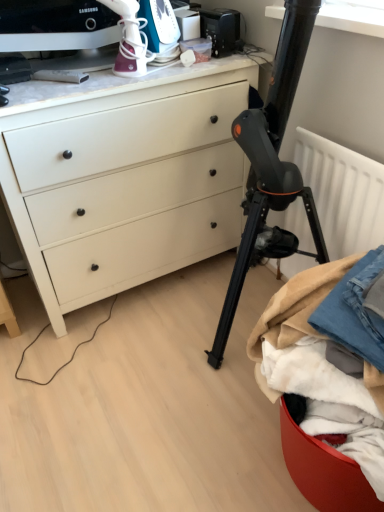
Where is `vacant space in front of matte white chest of drawers at upper left`? The height and width of the screenshot is (512, 384). vacant space in front of matte white chest of drawers at upper left is located at coordinates (122, 393).